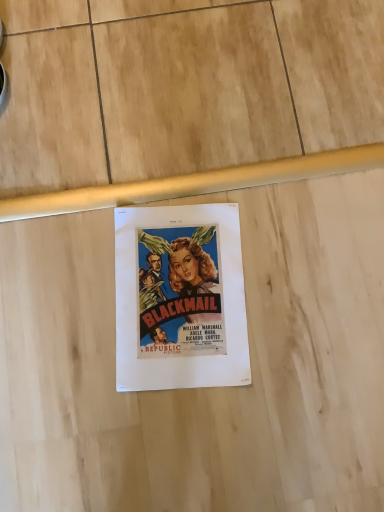
The width and height of the screenshot is (384, 512). In order to click on white paper poster at center in this screenshot , I will do `click(180, 298)`.

Describe the element at coordinates (180, 298) in the screenshot. I see `white paper poster at center` at that location.

The width and height of the screenshot is (384, 512). Find the location of `white paper poster at center`. white paper poster at center is located at coordinates (180, 298).